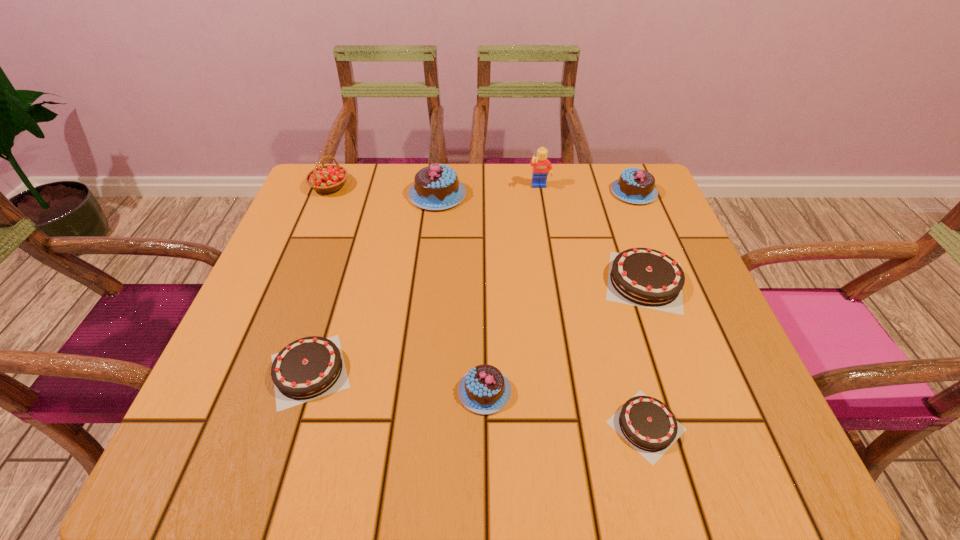
You are a GUI agent. You are given a task and a screenshot of the screen. Output one action in this format:
    pyautogui.click(x=<x>, y=<y>)
    Task: Click on the yellow Lego
    
    Given the screenshot: What is the action you would take?
    pyautogui.click(x=542, y=167)

The width and height of the screenshot is (960, 540). Identify the location of the fourth object from right to left. (542, 167).

The height and width of the screenshot is (540, 960). In order to click on brown strawberry in this screenshot , I will do `click(329, 178)`.

Identify the location of the biggest pink chocolate cake. The image size is (960, 540). (436, 187).

I want to click on the second smallest pink chocolate cake, so click(637, 186).

This screenshot has width=960, height=540. I want to click on the rightmost pink chocolate cake, so click(637, 186).

I want to click on the biggest brown chocolate cake, so click(644, 277).

In order to click on the third farthest chocolate cake in this screenshot , I will do `click(644, 277)`.

Locate an element on the screen. The height and width of the screenshot is (540, 960). the nearest pink chocolate cake is located at coordinates (484, 389).

This screenshot has height=540, width=960. Find the location of `the leftmost chocolate cake`. the leftmost chocolate cake is located at coordinates (311, 367).